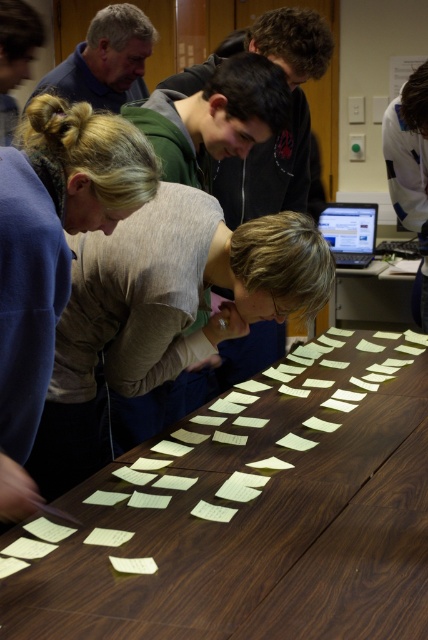
Can you confirm if brown wood table at center is shorter than blonde hair at upper left?

Correct, brown wood table at center is not as tall as blonde hair at upper left.

Is brown wood table at center further to the viewer compared to blonde hair at upper left?

No, it is in front of blonde hair at upper left.

Is point (20, 624) more distant than point (5, 102)?

No, it is not.

The height and width of the screenshot is (640, 428). What are the coordinates of `brown wood table at center` in the screenshot? It's located at (256, 538).

In the scene shown: Is gray sweater at center above blonde hair at upper left?

Incorrect, gray sweater at center is not positioned above blonde hair at upper left.

The height and width of the screenshot is (640, 428). Identify the location of gray sweater at center. (165, 308).

I want to click on gray sweater at center, so click(165, 308).

Which is below, brown wood table at center or matte gray sweater at left?

brown wood table at center is below.

Between point (223, 570) and point (38, 120), which one is positioned in front?

Point (223, 570) is in front.

Where is `brown wood table at center`? The image size is (428, 640). brown wood table at center is located at coordinates (256, 538).